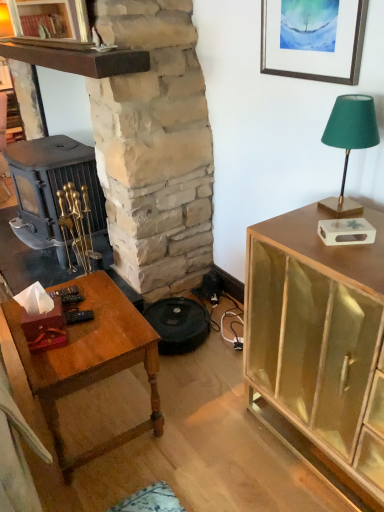
At what (x,y) coordinates should I click in order to perform the action: click on free spot below wooden table at lower left (from a real-world perspective). Please return your answer as a coordinate pair (x, y). The image size is (384, 512). Looking at the image, I should click on 96,410.